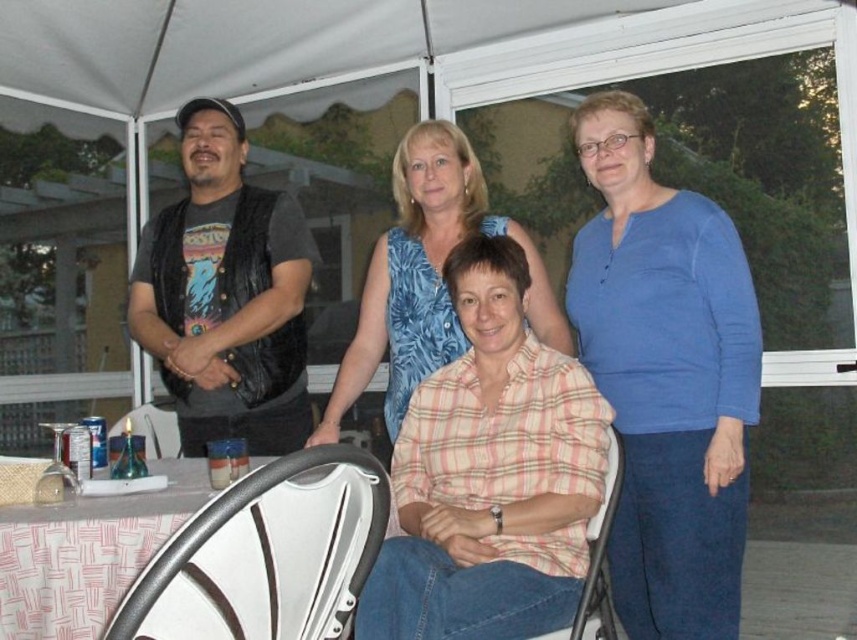
You are a photographer setting up a tripod to take a group photo. You notice the white leather chair at lower left and the blue floral dress at center. Which object should you avoid placing the tripod in front of to ensure both are visible in the frame?

You should avoid placing the tripod in front of the white leather chair at lower left because it has a lesser height compared to the blue floral dress at center. This ensures the taller blue floral dress at center won

You are a photographer setting up for a group photo. You need to position the pink plaid shirt at center and the white plastic chair at lower left in the frame. Based on their current positions, which object is closer to the right side of the image?

The pink plaid shirt at center is closer to the right side of the image because it is positioned to the right of the white plastic chair at lower left.